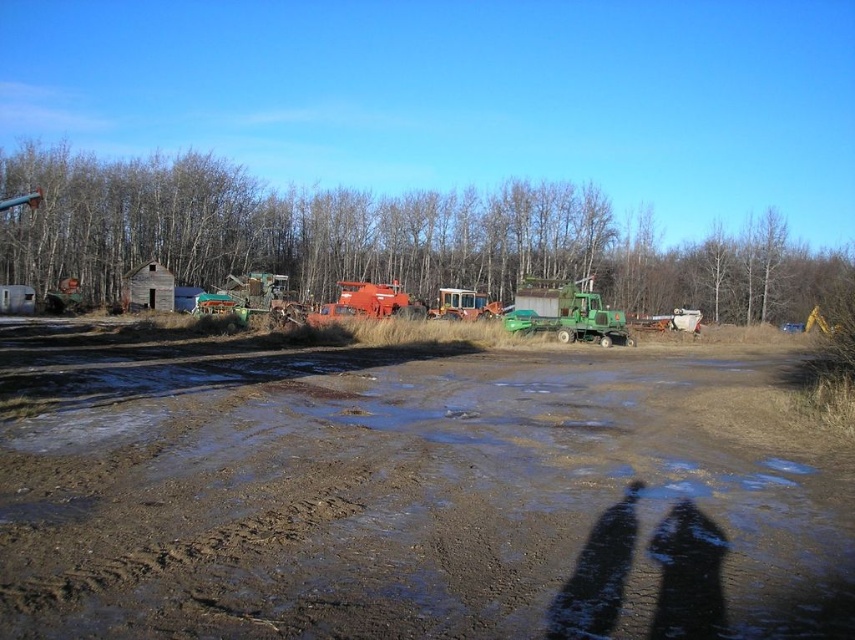
Question: Does brown wood tree at upper center come in front of weathered wood hut at left?

Choices:
 (A) no
 (B) yes

Answer: (A)

Question: Considering the real-world distances, which object is closest to the weathered wood hut at left?

Choices:
 (A) muddy brown dirt field at center
 (B) brown wood tree at upper center

Answer: (B)

Question: Which object appears closest to the camera in this image?

Choices:
 (A) brown wood tree at upper center
 (B) muddy brown dirt field at center

Answer: (B)

Question: Estimate the real-world distances between objects in this image. Which object is farther from the muddy brown dirt field at center?

Choices:
 (A) brown wood tree at upper center
 (B) weathered wood hut at left

Answer: (A)

Question: Can you confirm if brown wood tree at upper center is bigger than weathered wood hut at left?

Choices:
 (A) yes
 (B) no

Answer: (A)

Question: Considering the relative positions of brown wood tree at upper center and weathered wood hut at left in the image provided, where is brown wood tree at upper center located with respect to weathered wood hut at left?

Choices:
 (A) above
 (B) below

Answer: (A)